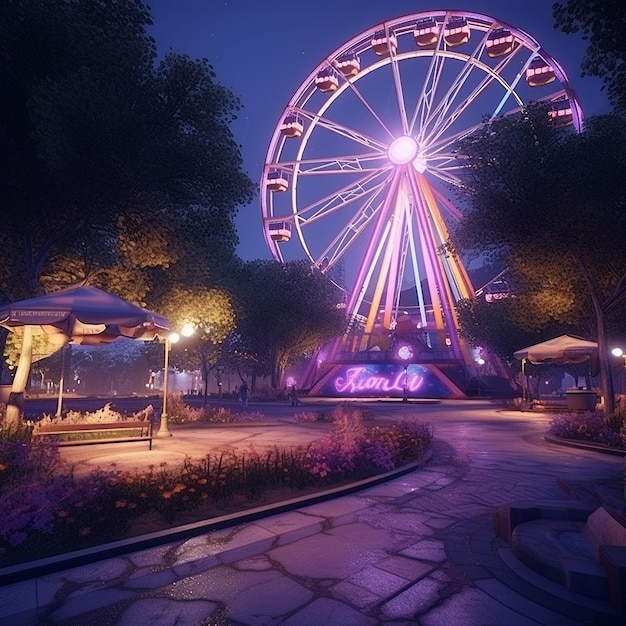
What are the coordinates of `lights` in the screenshot? It's located at (187, 334), (409, 141), (617, 347), (481, 359), (402, 352), (173, 337).